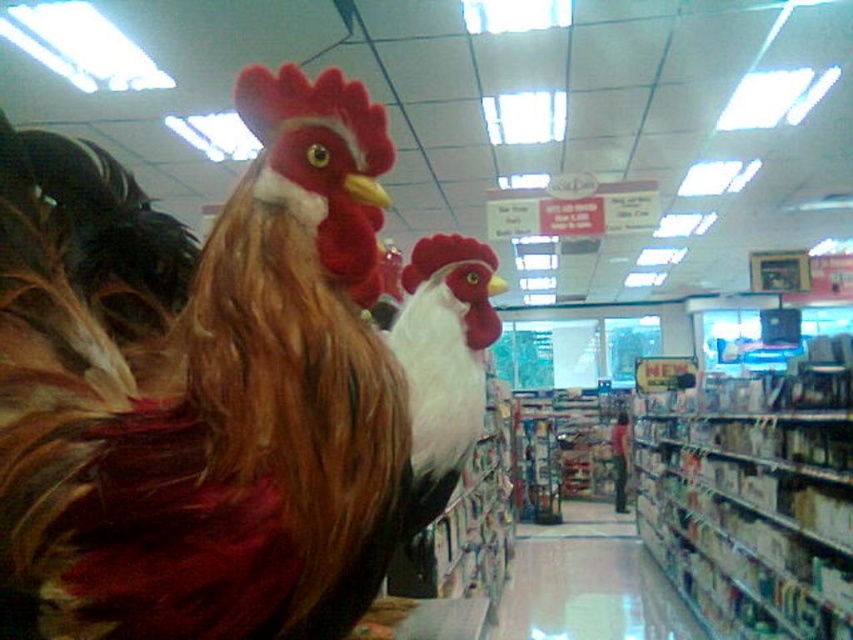
Question: Which point is closer to the camera taking this photo?

Choices:
 (A) (660, 481)
 (B) (618, 474)
 (C) (215, 577)
 (D) (531, 584)

Answer: (C)

Question: Which object is positioned farthest from the matte brown rooster at left?

Choices:
 (A) white cardboard boxes at center
 (B) white glossy aisle at center
 (C) white matte rooster at center
 (D) matte pink shirt at center

Answer: (D)

Question: Estimate the real-world distances between objects in this image. Which object is farther from the matte pink shirt at center?

Choices:
 (A) matte brown rooster at left
 (B) white matte rooster at center
 (C) white glossy aisle at center
 (D) white cardboard boxes at center

Answer: (A)

Question: Is white glossy aisle at center in front of matte pink shirt at center?

Choices:
 (A) yes
 (B) no

Answer: (A)

Question: Is white cardboard boxes at center wider than white glossy aisle at center?

Choices:
 (A) no
 (B) yes

Answer: (A)

Question: Is white cardboard boxes at center thinner than white matte rooster at center?

Choices:
 (A) yes
 (B) no

Answer: (B)